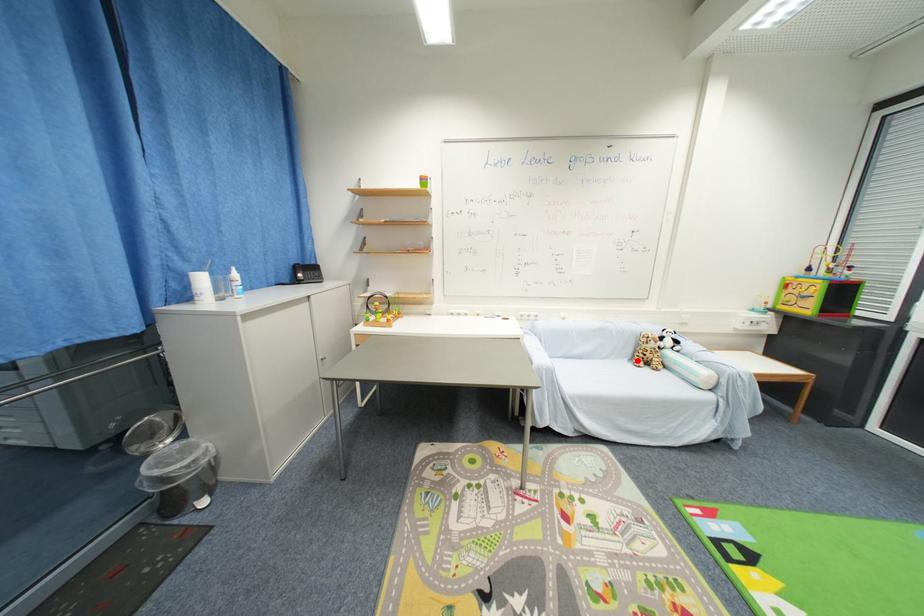
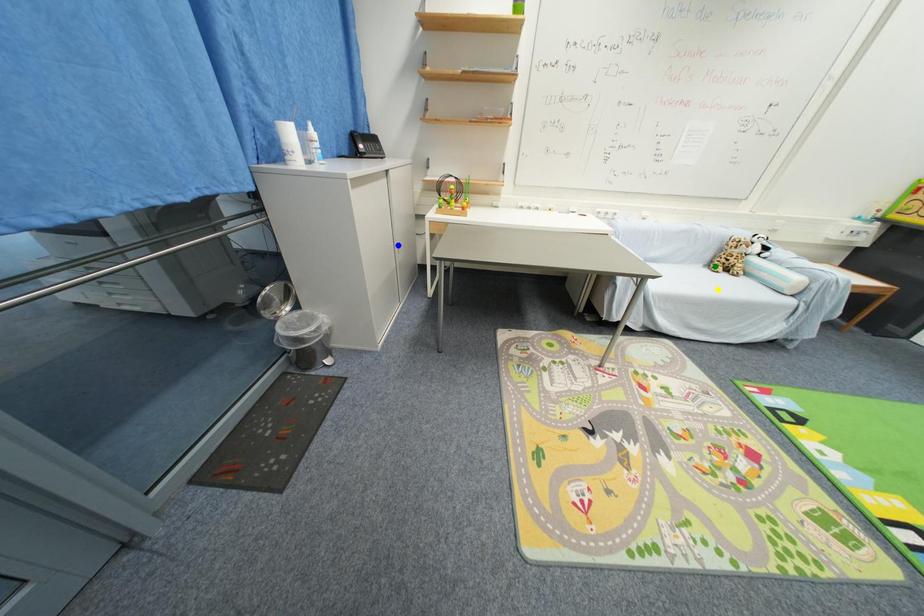
Question: I am providing you with two images of the same scene from different viewpoints. A red point is marked on the first image. You are given multiple points on the second image. Can you choose the point in image 2 that corresponds to the point in image 1?

Choices:
 (A) green point
 (B) yellow point
 (C) blue point

Answer: (A)